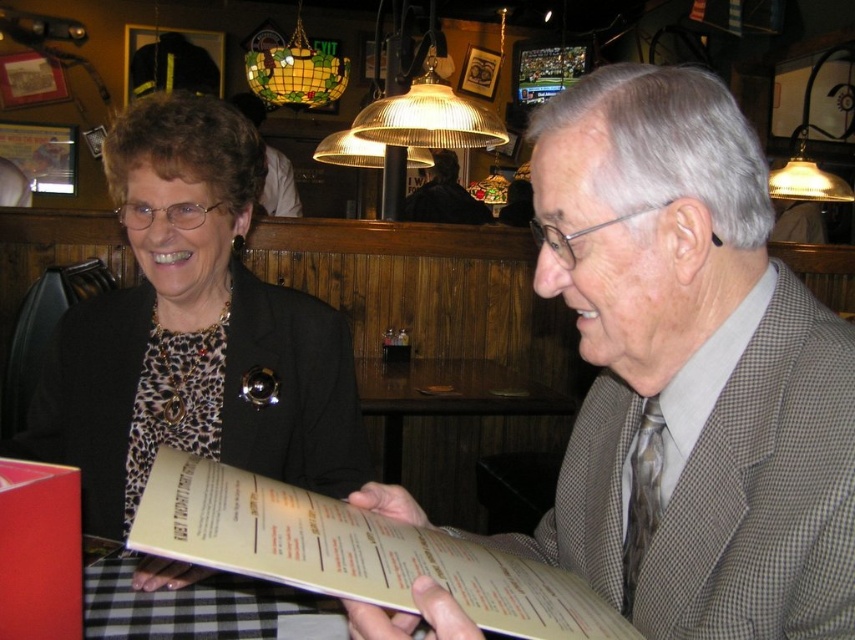
You are standing at the entrance of the restaurant and see two points marked on the floor. The first point is at coordinate point (351, 628) and the second is at point (116, 180). If you want to walk towards the point that is closer to the entrance, which coordinate should you head towards?

Point (116, 180) is closer to the entrance because it is behind point (351, 628), which is further away from the entrance.

You are a photographer positioned behind the two individuals at the table. You want to take a photo where both the gray checkered suit at center and the leopard print blouse at center are clearly visible. Which individual should you focus on first to ensure the other remains in focus?

You should focus on the gray checkered suit at center first since it is closer to the viewer than the leopard print blouse at center. By focusing on the closer object, the depth of field may allow the farther one to remain in focus as well.

Consider the image. You are a photographer trying to capture a closeup of the leopard print blouse at center. The camera you are using has a focal length of 50mm and a sensor size of 24mm x 36mm. If the blouse is positioned at point coordinates of 0.519, 0.228 in the image frame, what would be the best way to ensure the blouse is centered in your shot?

The leopard print blouse at center is already positioned at point coordinates of (193,332), so to center it in the shot, adjust the camera frame so that the blouse occupies the central point of the image, which is typically around (427,320). Slightly moving the camera to align the blouse closer to the center coordinates would ensure it is centered.